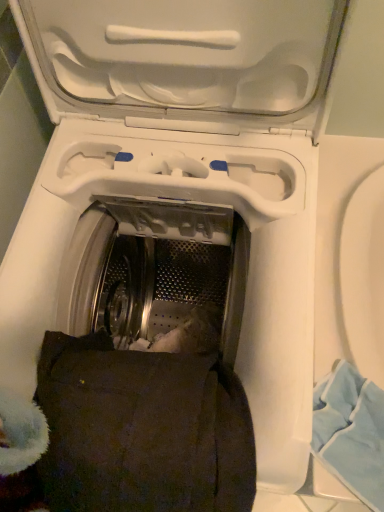
This screenshot has height=512, width=384. Describe the element at coordinates (142, 430) in the screenshot. I see `dark brown fabric pillow at lower center` at that location.

Where is `dark brown fabric pillow at lower center`? dark brown fabric pillow at lower center is located at coordinates (142, 430).

You are a GUI agent. You are given a task and a screenshot of the screen. Output one action in this format:
    pyautogui.click(x=<x>, y=<y>)
    Task: Click on the dark brown fabric pillow at lower center
    The height and width of the screenshot is (512, 384).
    Given the screenshot: What is the action you would take?
    pyautogui.click(x=142, y=430)